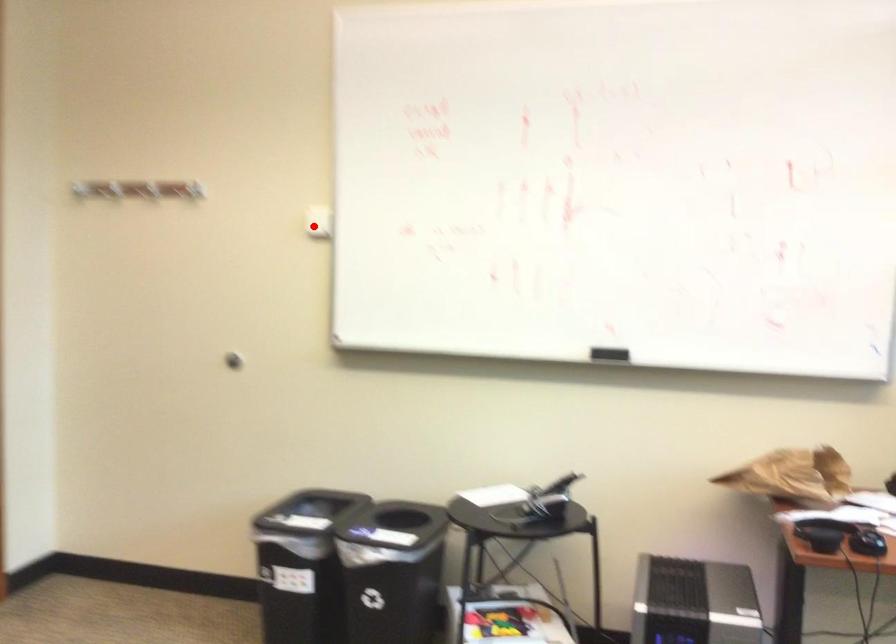
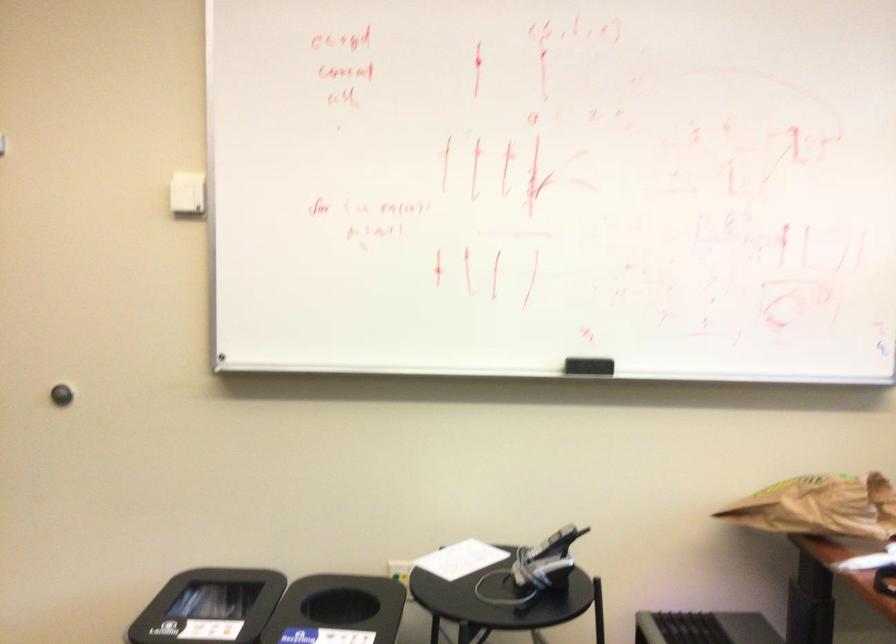
The point at the highlighted location is marked in the first image. Where is the corresponding point in the second image?

(186, 194)